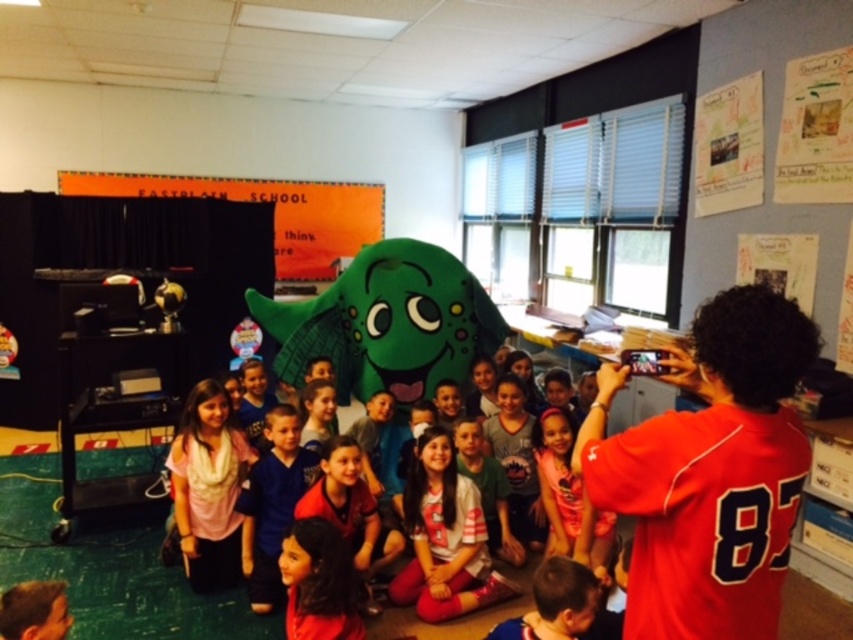
Does red jersey at upper right come in front of pink fabric dress at center?

Yes, red jersey at upper right is in front of pink fabric dress at center.

Locate an element on the screen. Image resolution: width=853 pixels, height=640 pixels. red jersey at upper right is located at coordinates (709, 472).

Based on the photo, between green plush toy at center and white cotton shirt at center, which one appears on the right side from the viewer's perspective?

white cotton shirt at center is more to the right.

Is the position of green plush toy at center more distant than that of white cotton shirt at center?

That is True.

Between point (486, 353) and point (480, 513), which one is positioned in front?

Point (480, 513)

Image resolution: width=853 pixels, height=640 pixels. Find the location of `green plush toy at center`. green plush toy at center is located at coordinates (386, 323).

Between red jersey at upper right and white cotton shirt at center, which one appears on the right side from the viewer's perspective?

From the viewer's perspective, red jersey at upper right appears more on the right side.

Is red jersey at upper right wider than white cotton shirt at center?

Incorrect, red jersey at upper right's width does not surpass white cotton shirt at center's.

Which is in front, point (751, 502) or point (460, 605)?

Point (751, 502)

Identify the location of red jersey at upper right. The width and height of the screenshot is (853, 640). (709, 472).